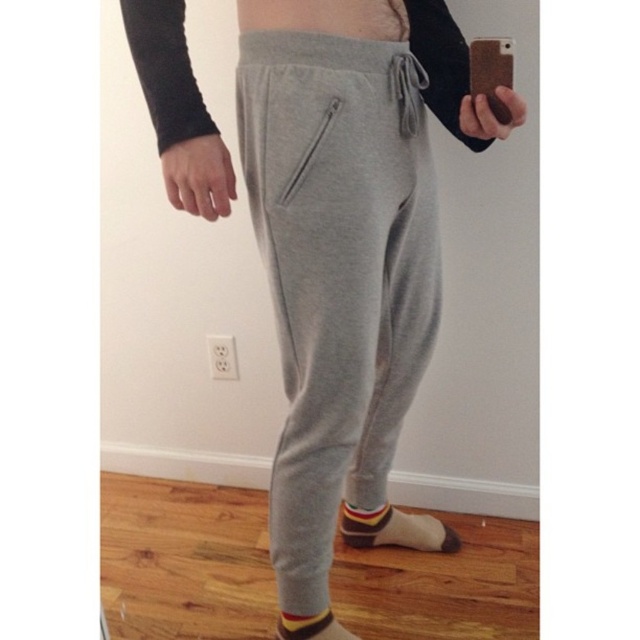
Between striped cotton sock at lower center and multicolored knit sock at lower center, which one appears on the left side from the viewer's perspective?

multicolored knit sock at lower center

Who is more distant from viewer, (412, 547) or (330, 624)?

The point (412, 547) is more distant.

The image size is (640, 640). In order to click on striped cotton sock at lower center in this screenshot , I will do pos(396,531).

In the scene shown: Does heather gray sweatpants at center have a lesser height compared to gray fabric pocket at center?

No, heather gray sweatpants at center is not shorter than gray fabric pocket at center.

Is heather gray sweatpants at center thinner than gray fabric pocket at center?

No, heather gray sweatpants at center is not thinner than gray fabric pocket at center.

You are a GUI agent. You are given a task and a screenshot of the screen. Output one action in this format:
    pyautogui.click(x=<x>, y=<y>)
    Task: Click on the heather gray sweatpants at center
    
    Given the screenshot: What is the action you would take?
    pyautogui.click(x=349, y=260)

Where is `heather gray sweatpants at center`? heather gray sweatpants at center is located at coordinates (349, 260).

Where is `gray fabric pocket at center`? This screenshot has width=640, height=640. gray fabric pocket at center is located at coordinates (304, 141).

Measure the distance between point (301, 129) and camera.

A distance of 36.58 inches exists between point (301, 129) and camera.

Between point (285, 102) and point (380, 525), which one is positioned in front?

Point (285, 102)

The height and width of the screenshot is (640, 640). I want to click on gray fabric pocket at center, so click(304, 141).